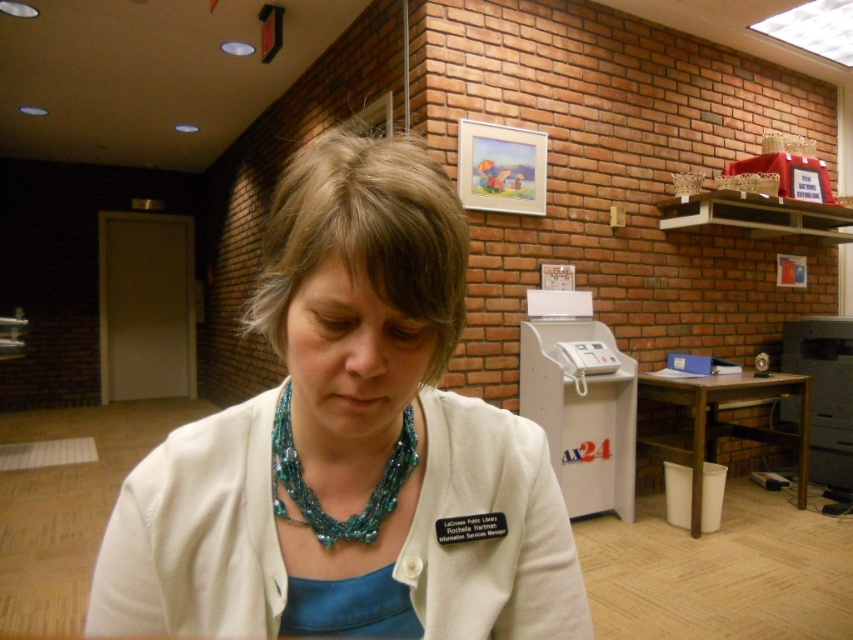
Question: Based on their relative distances, which object is farther from the white fabric jacket at center?

Choices:
 (A) brown wooden table at lower right
 (B) teal beaded necklace at center

Answer: (A)

Question: Is white fabric jacket at center in front of brown wooden table at lower right?

Choices:
 (A) yes
 (B) no

Answer: (A)

Question: Does white fabric jacket at center appear under brown wooden table at lower right?

Choices:
 (A) no
 (B) yes

Answer: (A)

Question: Which is farther from the brown wooden table at lower right?

Choices:
 (A) white fabric jacket at center
 (B) teal beaded necklace at center

Answer: (B)

Question: Can you confirm if white fabric jacket at center is bigger than teal beaded necklace at center?

Choices:
 (A) no
 (B) yes

Answer: (B)

Question: Considering the real-world distances, which object is farthest from the white fabric jacket at center?

Choices:
 (A) brown wooden table at lower right
 (B) teal beaded necklace at center

Answer: (A)